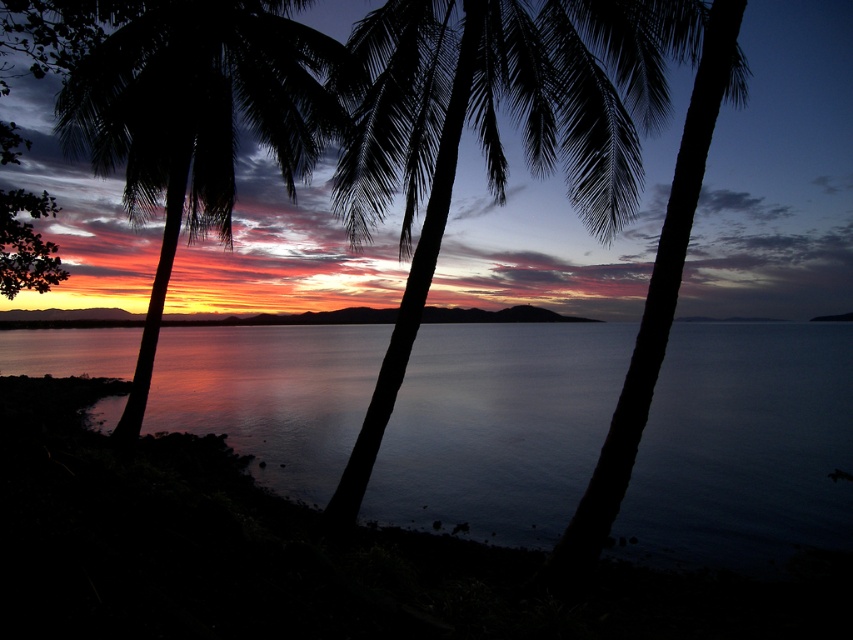
This screenshot has width=853, height=640. Describe the element at coordinates (743, 445) in the screenshot. I see `silvery reflective water at center` at that location.

Is silvery reflective water at center to the left of silhouette palm tree at left from the viewer's perspective?

In fact, silvery reflective water at center is to the right of silhouette palm tree at left.

Does point (618, 552) come in front of point (204, 74)?

Yes, it is in front of point (204, 74).

Locate an element on the screen. The width and height of the screenshot is (853, 640). silvery reflective water at center is located at coordinates (743, 445).

Does black leafy palm tree at center have a greater width compared to silhouette palm tree at left?

Correct, the width of black leafy palm tree at center exceeds that of silhouette palm tree at left.

Is black leafy palm tree at center thinner than silhouette palm tree at left?

No.

Measure the distance between point (425, 140) and camera.

A distance of 32.43 feet exists between point (425, 140) and camera.

Identify the location of black leafy palm tree at center. The width and height of the screenshot is (853, 640). (495, 131).

Does silvery reflective water at center have a lesser width compared to black leafy palm tree at center?

No, silvery reflective water at center is not thinner than black leafy palm tree at center.

Looking at this image, is silvery reflective water at center taller than black leafy palm tree at center?

A: Yes.

Is point (805, 372) farther from camera compared to point (607, 173)?

Yes.

I want to click on silvery reflective water at center, so click(x=743, y=445).